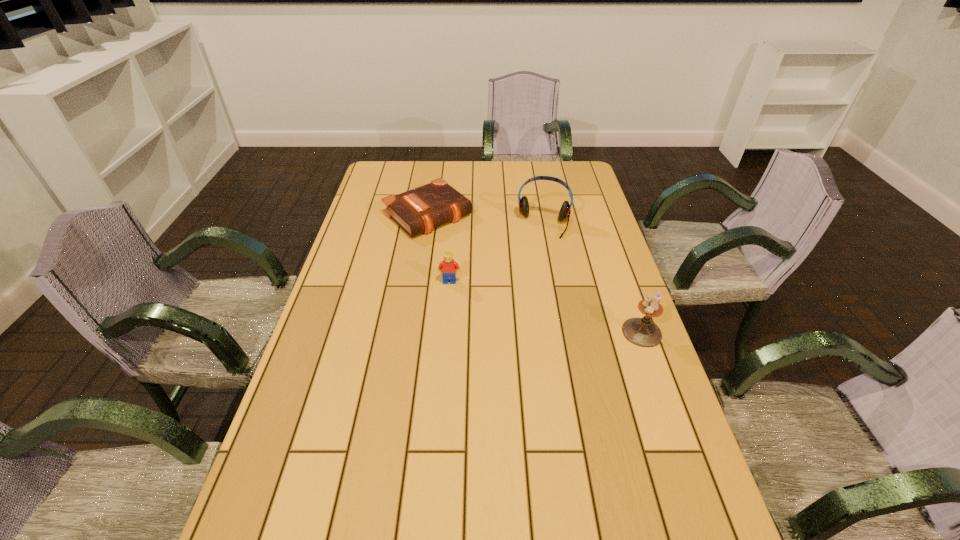
Identify the location of blank area located 0.390m with the microphone attached to the side of the headset. (525, 322).

I want to click on free space located 0.260m on the spine side of the Bible, so click(x=500, y=277).

Where is `blank area located 0.290m on the spine side of the Bible`? Image resolution: width=960 pixels, height=540 pixels. blank area located 0.290m on the spine side of the Bible is located at coordinates (506, 282).

Identify the location of free space located 0.100m on the spine side of the Bible. (469, 251).

You are a GUI agent. You are given a task and a screenshot of the screen. Output one action in this format:
    pyautogui.click(x=<x>, y=<y>)
    Task: Click on the object that is at the left edge
    The image size is (960, 540).
    Given the screenshot: What is the action you would take?
    pyautogui.click(x=420, y=210)

Locate an element on the screen. This screenshot has height=540, width=960. candle holder that is positioned at the right edge is located at coordinates (643, 332).

At what (x,y) coordinates should I click in order to perform the action: click on headset that is at the right edge. Please return your answer as a coordinate pair (x, y). The height and width of the screenshot is (540, 960). Looking at the image, I should click on (565, 211).

Find the location of a particular element. The width and height of the screenshot is (960, 540). vacant space at the far edge of the desktop is located at coordinates (492, 187).

Find the location of a particular element. free space at the near edge of the desktop is located at coordinates (439, 516).

The image size is (960, 540). Find the location of `free space at the left edge`. free space at the left edge is located at coordinates (303, 429).